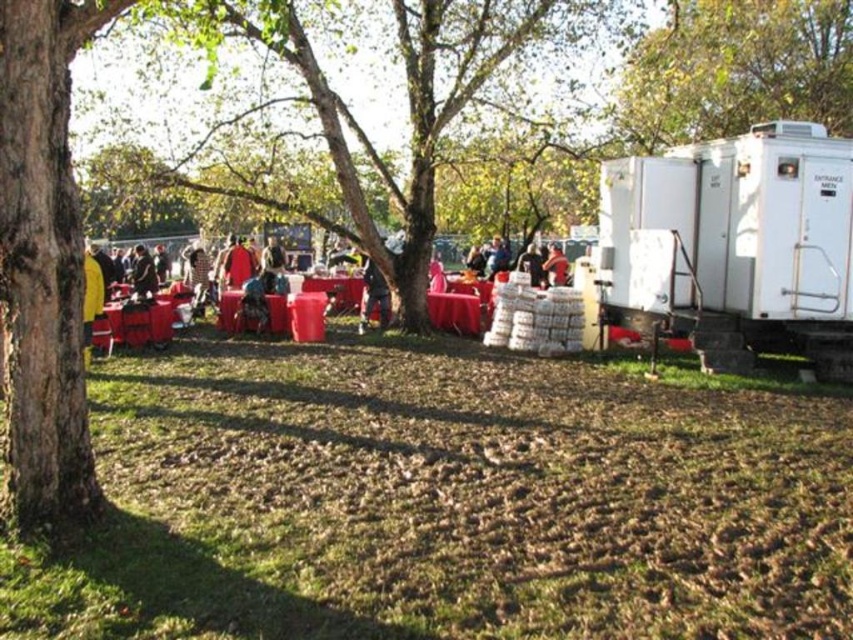
Which is behind, point (244, 244) or point (534, 259)?

The point (244, 244) is more distant.

Is matte red coat at center above matte black jacket at center?

Incorrect, matte red coat at center is not positioned above matte black jacket at center.

Between point (228, 264) and point (538, 280), which one is positioned in front?

Point (228, 264) is more forward.

Image resolution: width=853 pixels, height=640 pixels. Identify the location of matte red coat at center. [x=238, y=262].

Does point (480, 316) come closer to viewer compared to point (386, 323)?

No, (480, 316) is further to viewer.

Is smooth red table at center closer to the viewer compared to dark blue jeans at center?

That is False.

Find the location of a particular element. The width and height of the screenshot is (853, 640). smooth red table at center is located at coordinates pyautogui.click(x=456, y=312).

Is point (346, 285) positioned after point (155, 275)?

Yes, it is behind point (155, 275).

The width and height of the screenshot is (853, 640). Identify the location of matte plastic table at center. (335, 292).